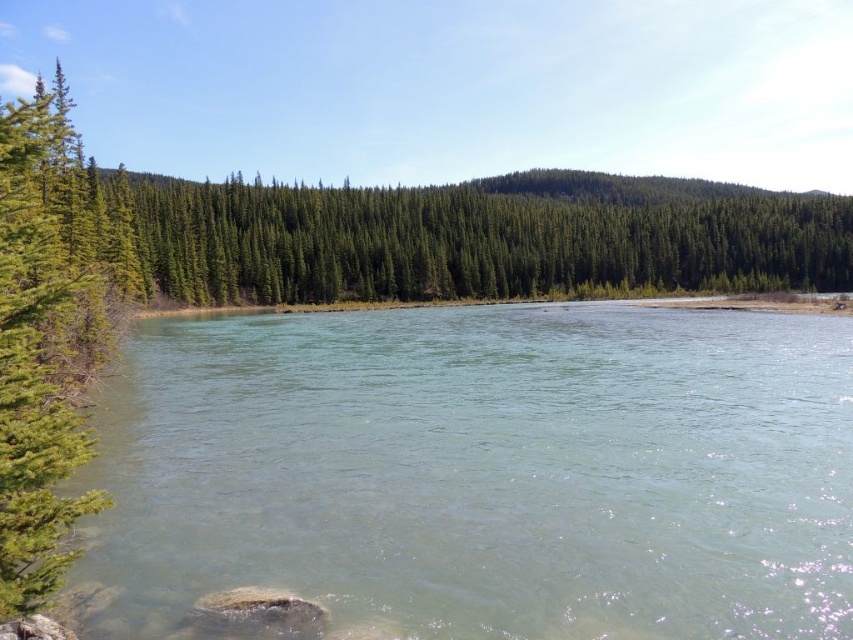
Question: Is green matte forest at center closer to camera compared to green textured pine tree at left?

Choices:
 (A) yes
 (B) no

Answer: (B)

Question: Is clear water at center positioned behind green textured pine tree at left?

Choices:
 (A) yes
 (B) no

Answer: (A)

Question: Which point appears farthest from the camera in this image?

Choices:
 (A) (677, 234)
 (B) (670, 474)
 (C) (15, 170)

Answer: (A)

Question: Which object is closer to the camera taking this photo?

Choices:
 (A) green matte forest at center
 (B) green textured pine tree at left

Answer: (B)

Question: Is clear water at center above green textured pine tree at left?

Choices:
 (A) yes
 (B) no

Answer: (B)

Question: Which point appears farthest from the camera in this image?

Choices:
 (A) (689, 188)
 (B) (15, 472)
 (C) (158, 584)

Answer: (A)